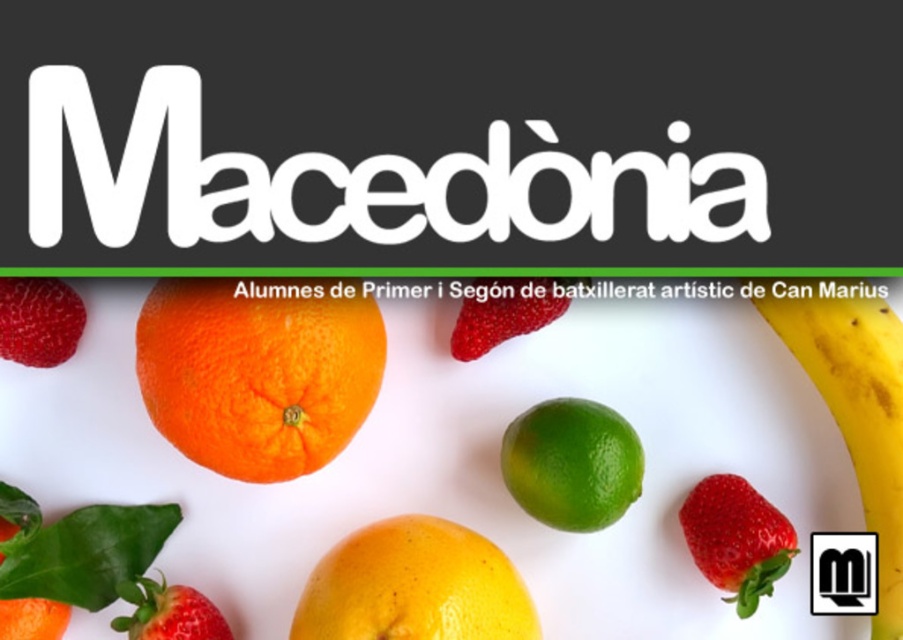
Which is more to the right, yellow matte grapefruit at center or red matte strawberry at lower right?

red matte strawberry at lower right

Which is behind, point (489, 605) or point (737, 538)?

The point (737, 538) is behind.

What do you see at coordinates (414, 586) in the screenshot? I see `yellow matte grapefruit at center` at bounding box center [414, 586].

The image size is (903, 640). Identify the location of yellow matte grapefruit at center. (414, 586).

Does yellow smooth banana at right come behind red matte strawberry at lower right?

No.

This screenshot has width=903, height=640. I want to click on yellow smooth banana at right, so pos(852,400).

Who is more forward, [888,417] or [770,541]?

Point [888,417]

This screenshot has height=640, width=903. Identify the location of yellow smooth banana at right. (852, 400).

Can you confirm if yellow matte grapefruit at center is shorter than matte orange tangerine at lower left?

Correct, yellow matte grapefruit at center is not as tall as matte orange tangerine at lower left.

Based on the photo, which is more to the right, yellow matte grapefruit at center or matte orange tangerine at lower left?

Positioned to the right is yellow matte grapefruit at center.

Measure the distance between point [486,636] and camera.

The distance of point [486,636] from camera is 1.12 meters.

You are a GUI agent. You are given a task and a screenshot of the screen. Output one action in this format:
    pyautogui.click(x=<x>, y=<y>)
    Task: Click on the yellow matte grapefruit at center
    
    Given the screenshot: What is the action you would take?
    pyautogui.click(x=414, y=586)